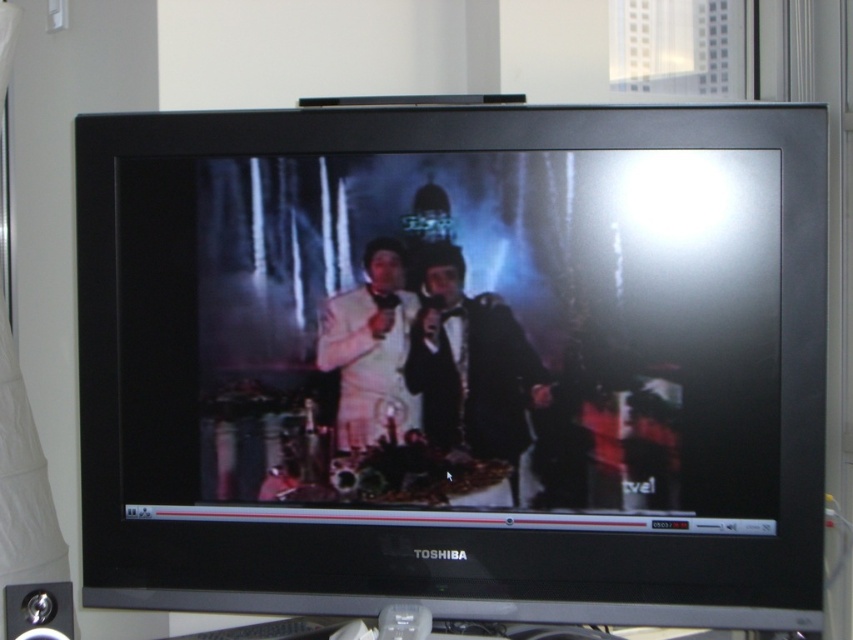
Can you confirm if black glossy monitor at center is wider than white satin suit at center?

Yes, black glossy monitor at center is wider than white satin suit at center.

Between point (93, 467) and point (340, 358), which one is positioned in front?

Point (340, 358)

Who is more distant from viewer, [634,253] or [347,340]?

Point [347,340]

Find the location of a particular element. Image resolution: width=853 pixels, height=640 pixels. black glossy monitor at center is located at coordinates (456, 362).

Can you confirm if black glossy monitor at center is shorter than black satin tuxedo at center?

In fact, black glossy monitor at center may be taller than black satin tuxedo at center.

Is point (727, 355) closer to viewer compared to point (521, 449)?

Yes, it is.

At what (x,y) coordinates should I click in order to perform the action: click on black glossy monitor at center. Please return your answer as a coordinate pair (x, y). This screenshot has width=853, height=640. Looking at the image, I should click on (456, 362).

Between black satin tuxedo at center and white satin suit at center, which one appears on the left side from the viewer's perspective?

Positioned to the left is white satin suit at center.

Is black satin tuxedo at center positioned before white satin suit at center?

Yes, it is in front of white satin suit at center.

Describe the element at coordinates (471, 364) in the screenshot. I see `black satin tuxedo at center` at that location.

Locate an element on the screen. black satin tuxedo at center is located at coordinates (471, 364).